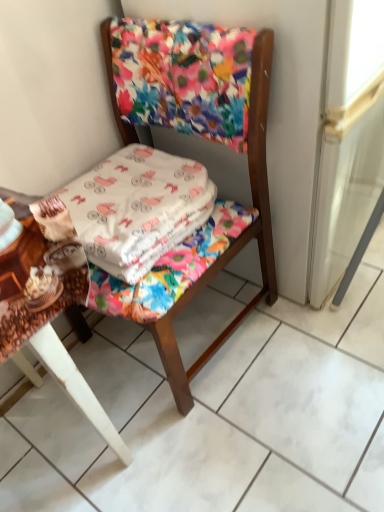
Where is `free location in front of floral fabric chair at center`? The width and height of the screenshot is (384, 512). free location in front of floral fabric chair at center is located at coordinates (221, 444).